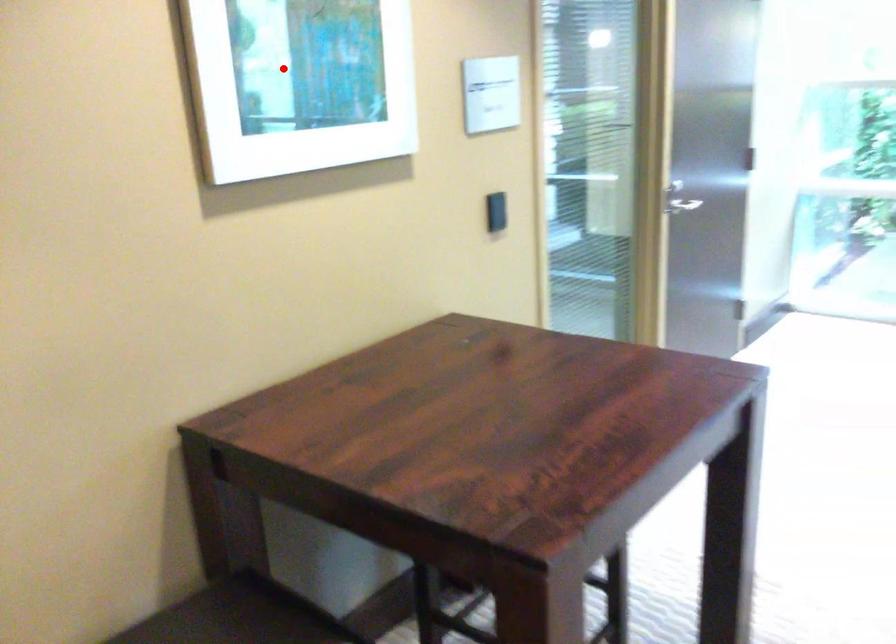
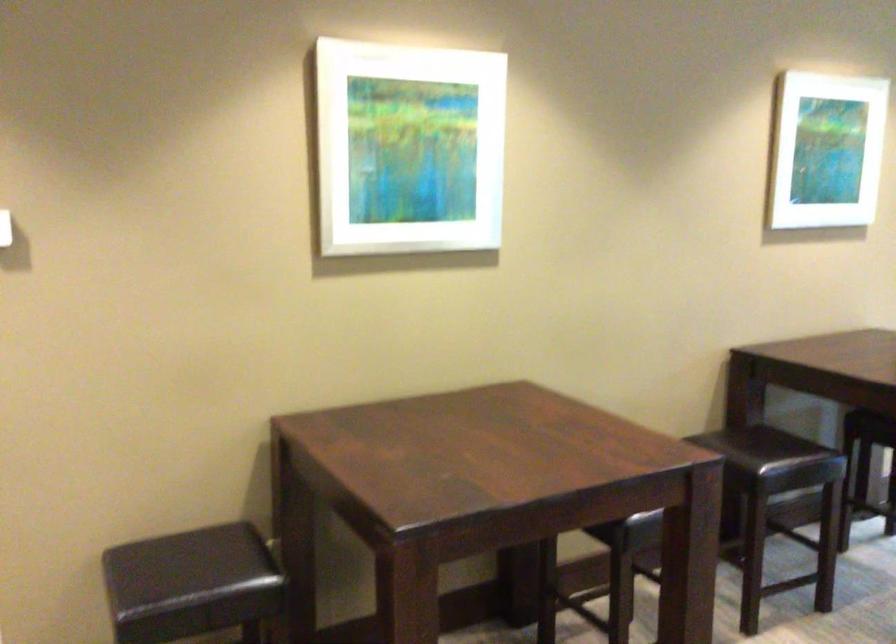
Locate, in the second image, the point that corresponds to the highlighted location in the first image.

(824, 149)